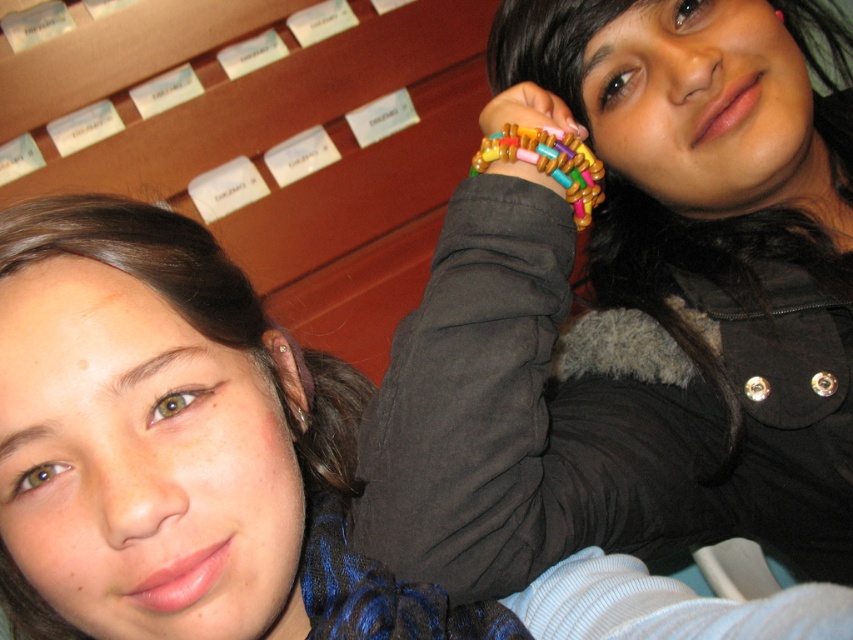
Question: From the image, what is the correct spatial relationship of matte black jacket at upper right in relation to beaded bracelet at center?

Choices:
 (A) right
 (B) left

Answer: (B)

Question: Is matte black jacket at upper right positioned at the back of wooden beads at upper center?

Choices:
 (A) yes
 (B) no

Answer: (B)

Question: Which object is the farthest from the multicolored beaded bracelet at upper right?

Choices:
 (A) matte black jacket at upper right
 (B) wooden beads at upper center

Answer: (A)

Question: Where is wooden beads at upper center located in relation to beaded bracelet at center in the image?

Choices:
 (A) below
 (B) above

Answer: (A)

Question: Among these points, which one is nearest to the camera?

Choices:
 (A) (527, 102)
 (B) (554, 168)
 (C) (505, 28)

Answer: (B)

Question: Which point is closer to the camera?

Choices:
 (A) (477, 154)
 (B) (123, 228)
 (C) (508, 120)

Answer: (B)